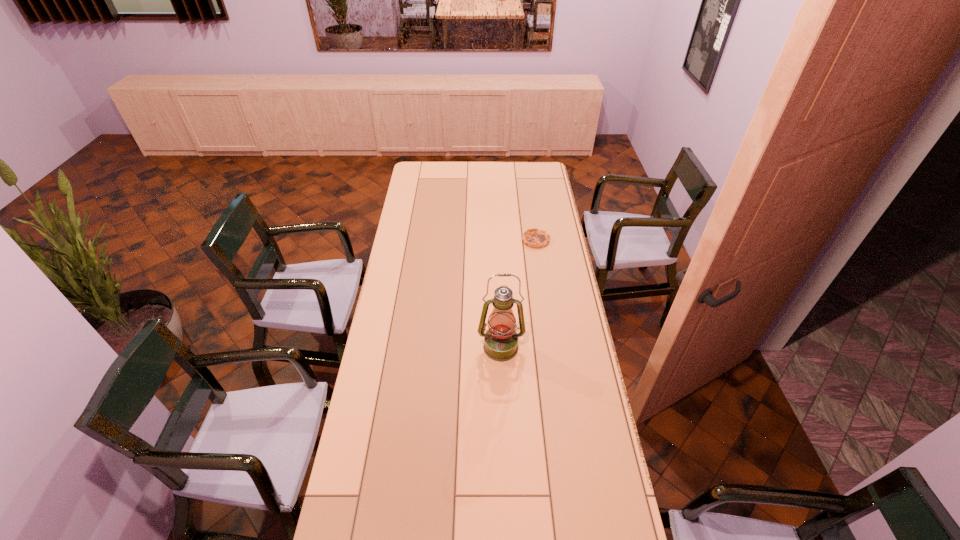
What are the coordinates of `the taller object` in the screenshot? It's located at (501, 340).

Locate an element on the screen. oil lamp is located at coordinates (501, 340).

Locate an element on the screen. the farther object is located at coordinates (534, 237).

Where is `the right object`? Image resolution: width=960 pixels, height=540 pixels. the right object is located at coordinates (534, 237).

Where is `vacant space located on the back of the nearer object`? vacant space located on the back of the nearer object is located at coordinates (499, 300).

Locate an element on the screen. This screenshot has height=540, width=960. vacant space located 0.360m on the front of the farther object is located at coordinates tap(545, 303).

At what (x,y) coordinates should I click in order to perform the action: click on object present at the right edge. Please return your answer as a coordinate pair (x, y). The image size is (960, 540). Looking at the image, I should click on (534, 237).

I want to click on free location at the far edge, so click(x=466, y=182).

In the image, there is a desktop. Where is `free space at the left edge`? The height and width of the screenshot is (540, 960). free space at the left edge is located at coordinates (412, 213).

Identify the location of vacant area at the right edge. (558, 295).